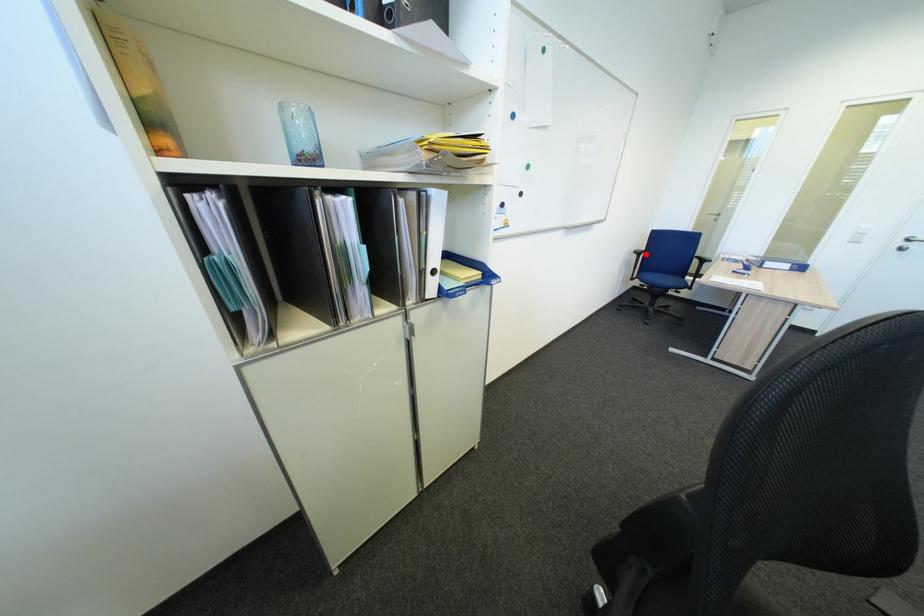
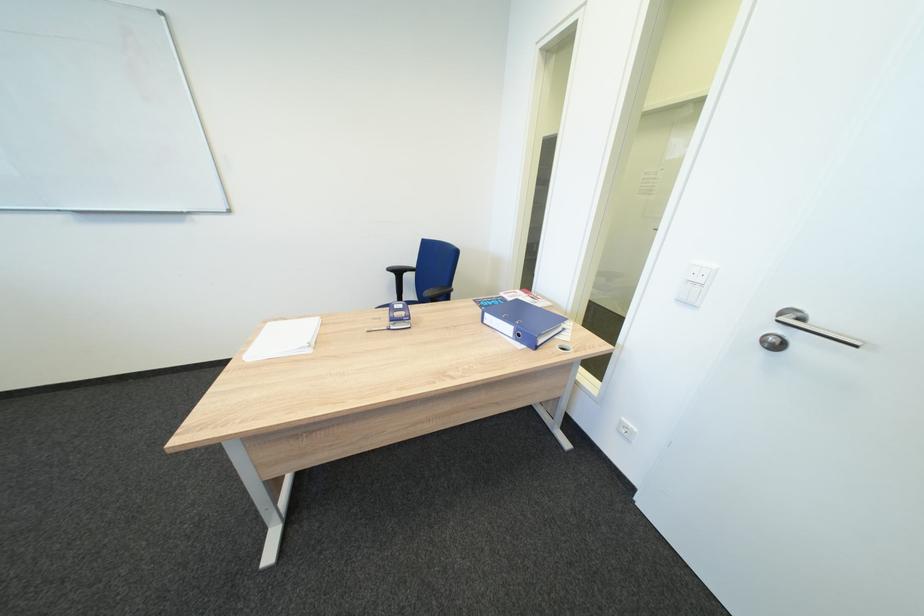
Where in the second image is the point corresponding to the highlighted location from the first image?

(400, 270)